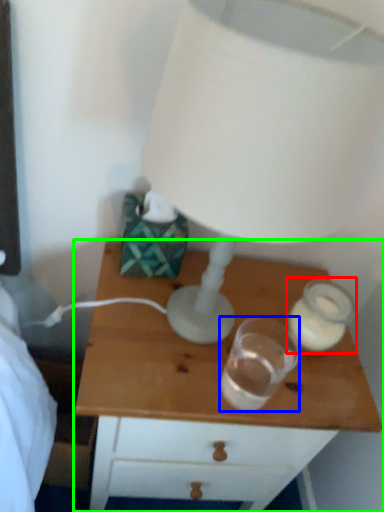
Question: Based on their relative distances, which object is farther from candle holder (highlighted by a red box)? Choose from candle holder (highlighted by a blue box) and nightstand (highlighted by a green box).

Choices:
 (A) candle holder
 (B) nightstand

Answer: (B)